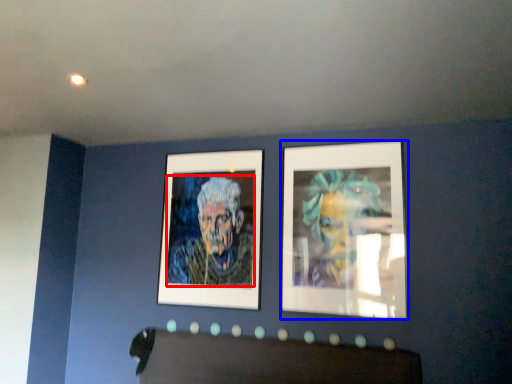
Question: Among these objects, which one is nearest to the camera, person (highlighted by a red box) or picture frame (highlighted by a blue box)?

Choices:
 (A) person
 (B) picture frame

Answer: (B)